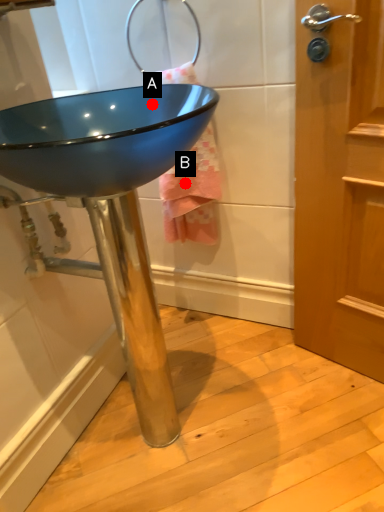
Question: Two points are circled on the image, labeled by A and B beside each circle. Among these points, which one is farthest from the camera?

Choices:
 (A) A is further
 (B) B is further

Answer: (B)